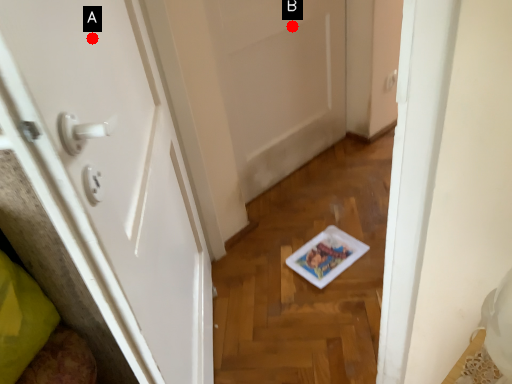
Question: Two points are circled on the image, labeled by A and B beside each circle. Which of the following is the farthest from the observer?

Choices:
 (A) A is further
 (B) B is further

Answer: (B)